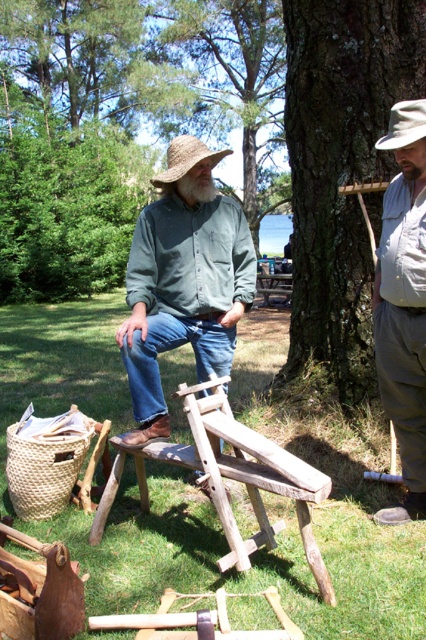
Which is more to the right, brown rough bark at center or green bark tree at upper center?

From the viewer's perspective, green bark tree at upper center appears more on the right side.

Which is in front, point (365, 26) or point (170, 29)?

Point (365, 26)

You are a GUI agent. You are given a task and a screenshot of the screen. Output one action in this format:
    pyautogui.click(x=<x>, y=<y>)
    Task: Click on the brown rough bark at center
    The image size is (426, 640).
    Given the screenshot: What is the action you would take?
    pyautogui.click(x=340, y=170)

What do you see at coordinates (183, 284) in the screenshot?
I see `green matte shirt at center` at bounding box center [183, 284].

Can you confirm if green matte shirt at center is positioned to the right of brown straw hat at center?

Indeed, green matte shirt at center is positioned on the right side of brown straw hat at center.

Who is more forward, (252, 289) or (160, 179)?

Point (160, 179) is in front.

I want to click on green matte shirt at center, so click(183, 284).

Between point (376, 3) and point (420, 356), which one is positioned in front?

Positioned in front is point (420, 356).

Which is more to the left, brown rough bark at center or gray cotton shirt at upper right?

brown rough bark at center

I want to click on brown rough bark at center, so click(340, 170).

Where is `brown rough bark at center`? brown rough bark at center is located at coordinates (340, 170).